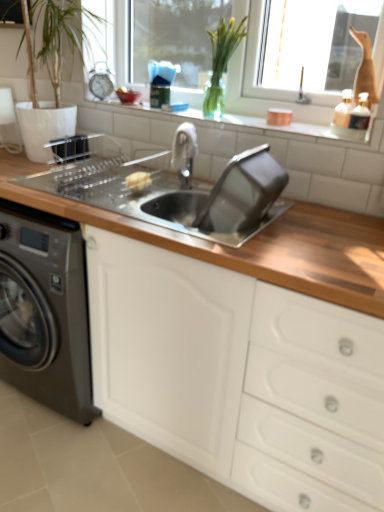
The image size is (384, 512). I want to click on green glass vase at upper center, so click(x=221, y=62).

The width and height of the screenshot is (384, 512). What do you see at coordinates (221, 62) in the screenshot?
I see `green glass vase at upper center` at bounding box center [221, 62].

This screenshot has height=512, width=384. Describe the element at coordinates (184, 153) in the screenshot. I see `polished chrome faucet at center` at that location.

Identify the location of wooden countertop at center. (252, 243).

Measure the distance between white plastic window frame at upper center and camera.

white plastic window frame at upper center is 5.20 feet away from camera.

What is the approximate width of yellow sponge at sink?

It is 10.04 centimeters.

The height and width of the screenshot is (512, 384). What do you see at coordinates (238, 376) in the screenshot?
I see `wooden countertop at center` at bounding box center [238, 376].

At what (x,y) coordinates should I click in order to perform the action: click on green glass vase at upper center. Please return your answer as a coordinate pair (x, y). Looking at the image, I should click on (221, 62).

Looking at this image, from a real-world perspective, is white glossy tile at upper center physically above wooden countertop at center?

Yes.

Is white glossy tile at upper center facing towards wooden countertop at center?

Yes, white glossy tile at upper center faces towards wooden countertop at center.

Between white glossy tile at upper center and wooden countertop at center, which one has smaller size?

Smaller between the two is white glossy tile at upper center.

Which of these two, wooden countertop at center or polished chrome faucet at center, is bigger?

→ wooden countertop at center.

Does wooden countertop at center turn towards polished chrome faucet at center?

No, wooden countertop at center is not facing towards polished chrome faucet at center.

Considering the relative positions of wooden countertop at center and polished chrome faucet at center in the image provided, is wooden countertop at center to the left of polished chrome faucet at center from the viewer's perspective?

Correct, you'll find wooden countertop at center to the left of polished chrome faucet at center.

From the picture: From a real-world perspective, between wooden countertop at center and polished chrome faucet at center, who is vertically lower?

From a 3D spatial view, wooden countertop at center is below.

Which is behind, point (152, 135) or point (185, 179)?

Point (152, 135)

In terms of height, does white glossy tile at upper center look taller or shorter compared to polished chrome faucet at center?

white glossy tile at upper center is shorter than polished chrome faucet at center.

In the scene shown: Which object is closer to the camera taking this photo, white glossy tile at upper center or polished chrome faucet at center?

polished chrome faucet at center is in front.

Does white glossy tile at upper center turn towards polished chrome faucet at center?

Yes, white glossy tile at upper center is aimed at polished chrome faucet at center.

Is polished chrome faucet at center far away from wooden countertop at center?

Actually, polished chrome faucet at center and wooden countertop at center are a little close together.

Does polished chrome faucet at center lie behind wooden countertop at center?

Yes, polished chrome faucet at center is behind wooden countertop at center.

Consider the image. Considering the sizes of objects green glass vase at upper center and white glossy tile at upper center in the image provided, who is shorter, green glass vase at upper center or white glossy tile at upper center?

With less height is white glossy tile at upper center.

Is green glass vase at upper center closer to camera compared to white glossy tile at upper center?

No, green glass vase at upper center is further to the viewer.

Could you tell me if green glass vase at upper center is facing white glossy tile at upper center?

No.

Considering the sizes of objects green glass vase at upper center and white glossy tile at upper center in the image provided, who is bigger, green glass vase at upper center or white glossy tile at upper center?

green glass vase at upper center is bigger.

From the image's perspective, would you say white plastic window frame at upper center is shown under polished chrome faucet at center?

No, from the image's perspective, white plastic window frame at upper center is not beneath polished chrome faucet at center.

From a real-world perspective, does white plastic window frame at upper center stand above polished chrome faucet at center?

Indeed, from a real-world perspective, white plastic window frame at upper center stands above polished chrome faucet at center.

Is polished chrome faucet at center at the back of white plastic window frame at upper center?

No, white plastic window frame at upper center's orientation is not away from polished chrome faucet at center.

Locate an element on the screen. The width and height of the screenshot is (384, 512). window frame on the right of the polished chrome faucet at center is located at coordinates (260, 87).

From the image's perspective, which one is positioned higher, white plastic window frame at upper center or wooden countertop at center?

white plastic window frame at upper center appears higher in the image.

Looking at the image, does white plastic window frame at upper center seem bigger or smaller compared to wooden countertop at center?

Clearly, white plastic window frame at upper center is smaller in size than wooden countertop at center.

Considering the positions of objects white plastic window frame at upper center and wooden countertop at center in the image provided, who is more to the left, white plastic window frame at upper center or wooden countertop at center?

wooden countertop at center.

From a real-world perspective, is white plastic window frame at upper center located higher than wooden countertop at center?

Yes.

Where is `countertop on the left of white glossy tile at upper center`? countertop on the left of white glossy tile at upper center is located at coordinates (252, 243).

Where is `tap that is above the wooden countertop at center (from the image's perspective)`? The width and height of the screenshot is (384, 512). tap that is above the wooden countertop at center (from the image's perspective) is located at coordinates (184, 153).

Looking at the image, which one is located closer to polished chrome faucet at center, white glossy tile at upper center or white plastic window frame at upper center?

Based on the image, white glossy tile at upper center appears to be nearer to polished chrome faucet at center.

Looking at the image, which one is located closer to wooden countertop at center, polished chrome faucet at center or yellow sponge at sink?

yellow sponge at sink is positioned closer to the anchor wooden countertop at center.

Considering their positions, is wooden countertop at center positioned closer to white glossy tile at upper center than wooden countertop at center?

The object closer to white glossy tile at upper center is wooden countertop at center.

From the image, which object appears to be farther from white glossy tile at upper center, white plastic window frame at upper center or yellow sponge at sink?

yellow sponge at sink is further to white glossy tile at upper center.

When comparing their distances from white glossy tile at upper center, does yellow sponge at sink or wooden countertop at center seem further?

wooden countertop at center lies further to white glossy tile at upper center than the other object.

Considering their positions, is wooden countertop at center positioned closer to polished chrome faucet at center than wooden countertop at center?

Based on the image, wooden countertop at center appears to be nearer to polished chrome faucet at center.

Considering their positions, is green glass vase at upper center positioned further to wooden countertop at center than wooden countertop at center?

The object further to wooden countertop at center is green glass vase at upper center.

Consider the image. Based on their spatial positions, is yellow sponge at sink or white plastic window frame at upper center further from green glass vase at upper center?

The object further to green glass vase at upper center is yellow sponge at sink.

Locate an element on the screen. The width and height of the screenshot is (384, 512). tap between white plastic window frame at upper center and wooden countertop at center from top to bottom is located at coordinates (184, 153).

Locate an element on the screen. This screenshot has height=512, width=384. tap between green glass vase at upper center and yellow sponge at sink in the up-down direction is located at coordinates point(184,153).

Where is `tap that lies between green glass vase at upper center and wooden countertop at center from top to bottom`? The height and width of the screenshot is (512, 384). tap that lies between green glass vase at upper center and wooden countertop at center from top to bottom is located at coordinates (184, 153).

Where is `window sill between green glass vase at upper center and wooden countertop at center in the vertical direction`? The width and height of the screenshot is (384, 512). window sill between green glass vase at upper center and wooden countertop at center in the vertical direction is located at coordinates 185,120.